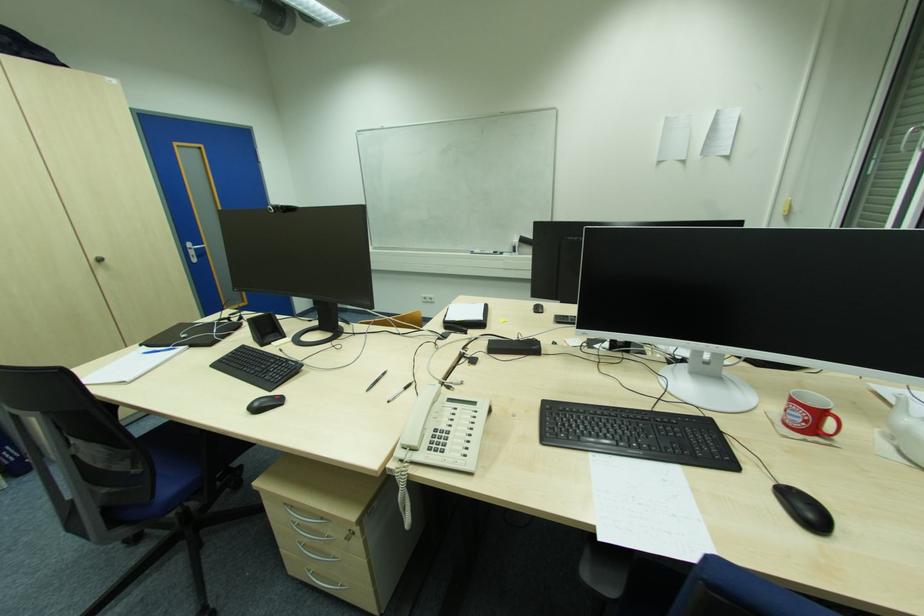
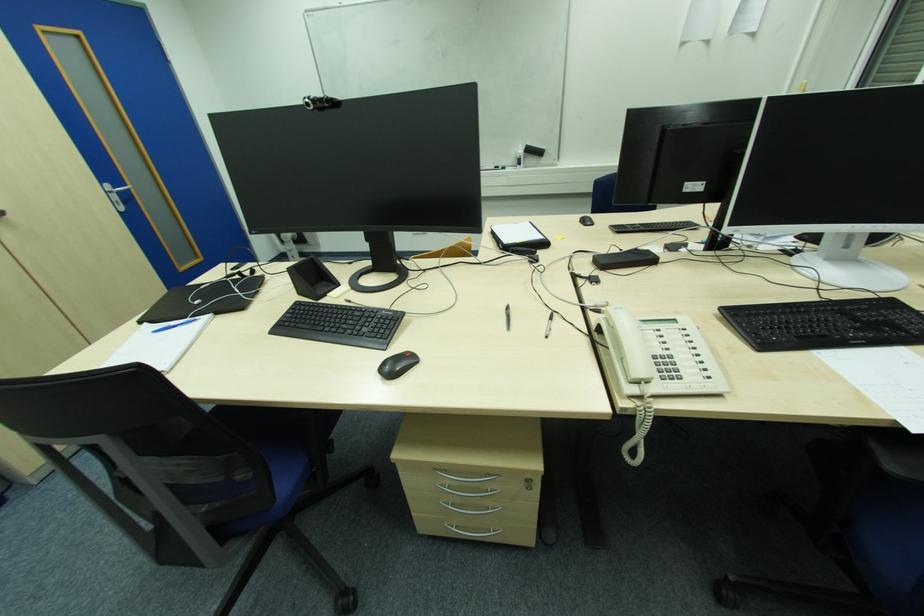
Locate, in the second image, the point that corresponds to point 260,370 in the first image.

(346, 328)